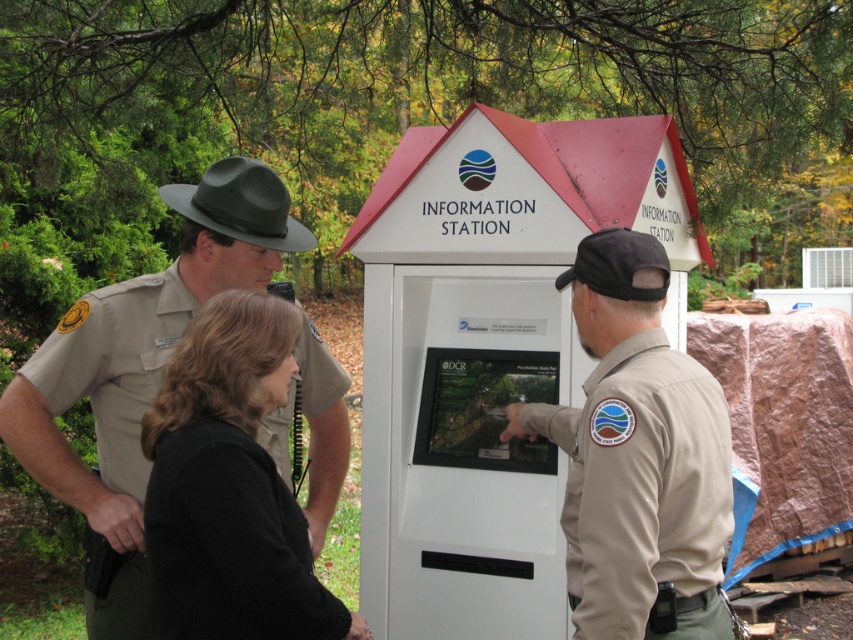
Question: Considering the relative positions of tan uniform at left and black fabric jacket at center in the image provided, where is tan uniform at left located with respect to black fabric jacket at center?

Choices:
 (A) left
 (B) right

Answer: (A)

Question: Which object is farther from the camera taking this photo?

Choices:
 (A) tan uniform at left
 (B) black fabric jacket at center

Answer: (A)

Question: Which object is closer to the camera taking this photo?

Choices:
 (A) black fabric jacket at center
 (B) tan uniform at left
 (C) tan uniform at center

Answer: (A)

Question: Is tan uniform at center positioned at the back of tan uniform at left?

Choices:
 (A) no
 (B) yes

Answer: (A)

Question: Which of the following is the farthest from the observer?

Choices:
 (A) tan uniform at left
 (B) black fabric jacket at center
 (C) tan uniform at center

Answer: (A)

Question: Is tan uniform at center thinner than black fabric jacket at center?

Choices:
 (A) no
 (B) yes

Answer: (A)